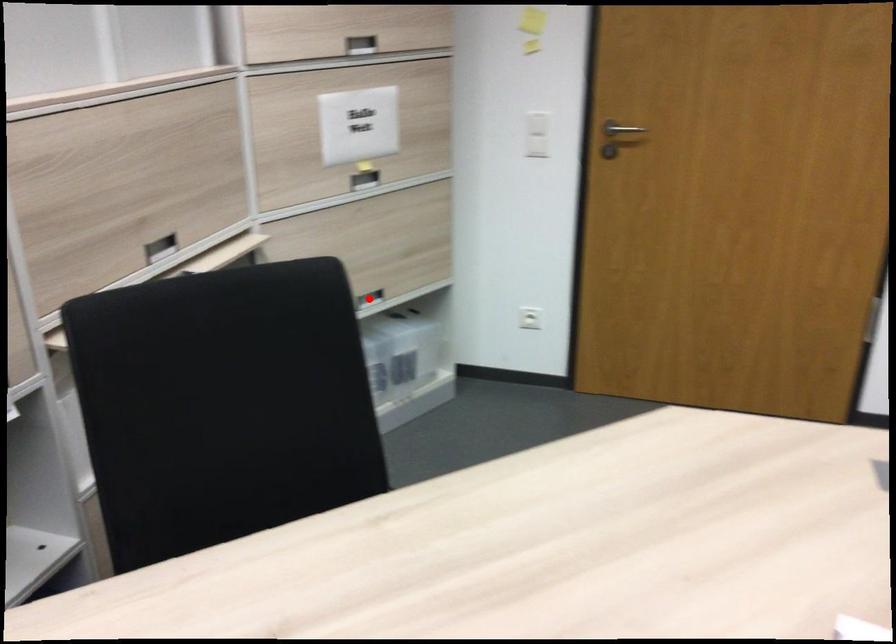
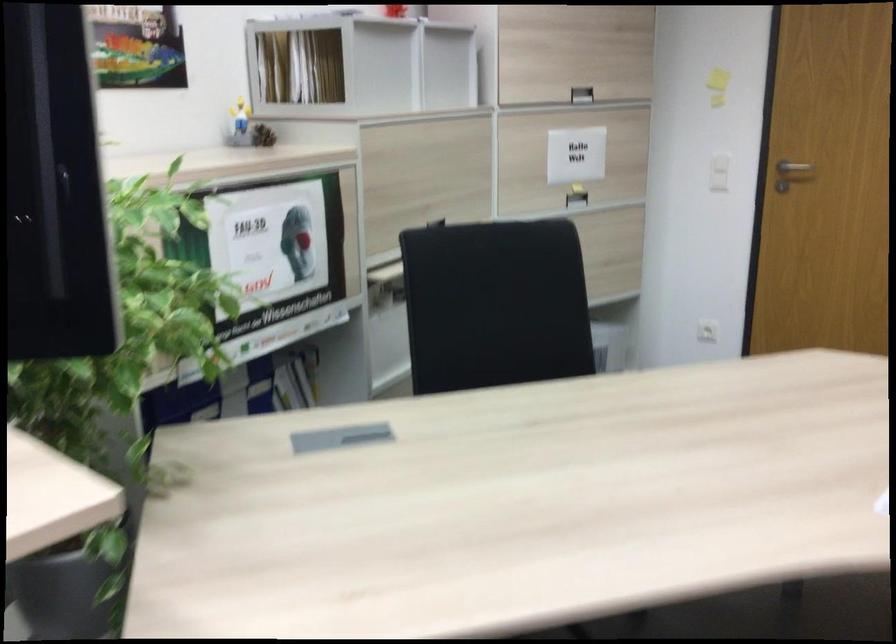
Question: I am providing you with two images of the same scene from different viewpoints. A red point is marked on the first image. Is the red point's position out of view in image 2?

Choices:
 (A) Yes
 (B) No

Answer: (A)